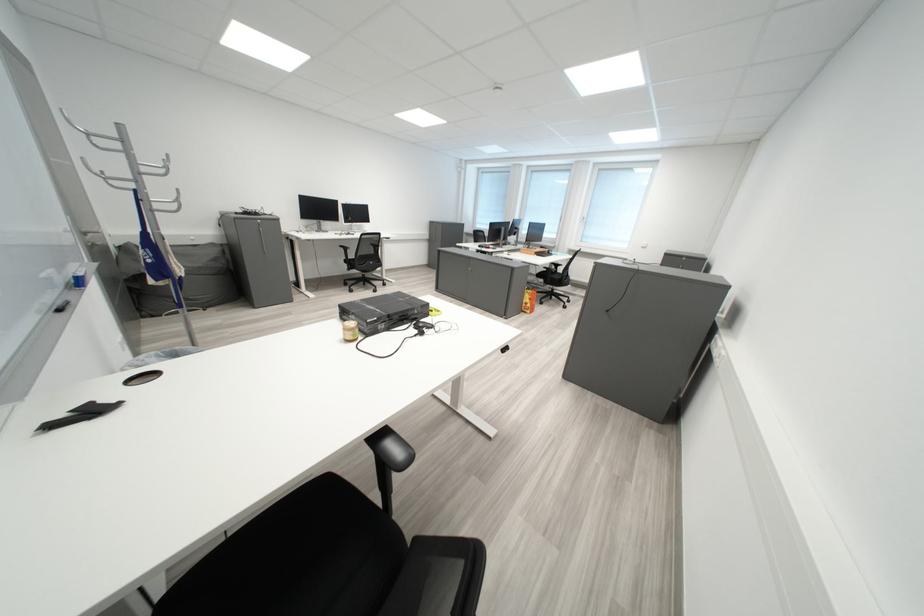
The height and width of the screenshot is (616, 924). I want to click on grey bean bag, so click(179, 278).